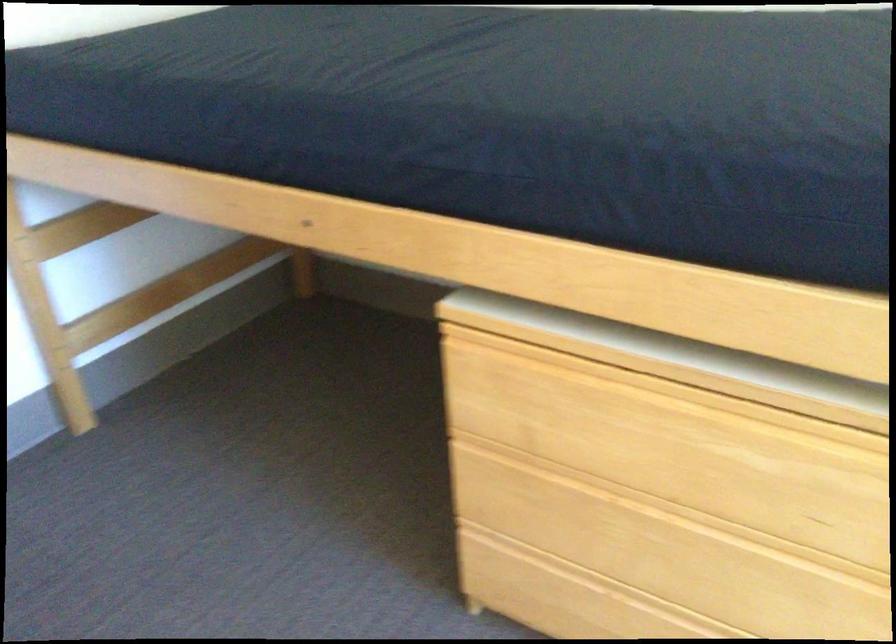
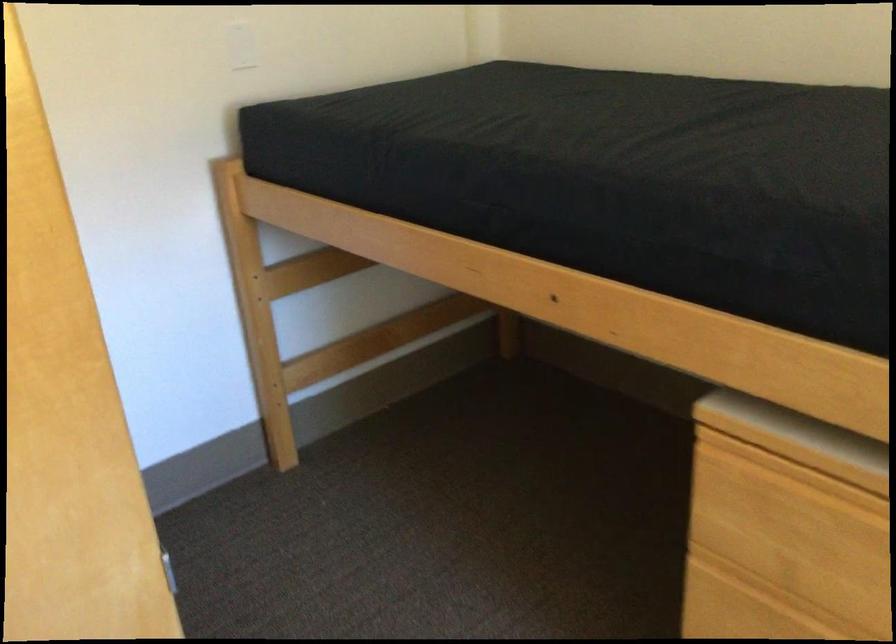
In the second image, find the point that corresponds to (108,327) in the first image.

(319, 368)